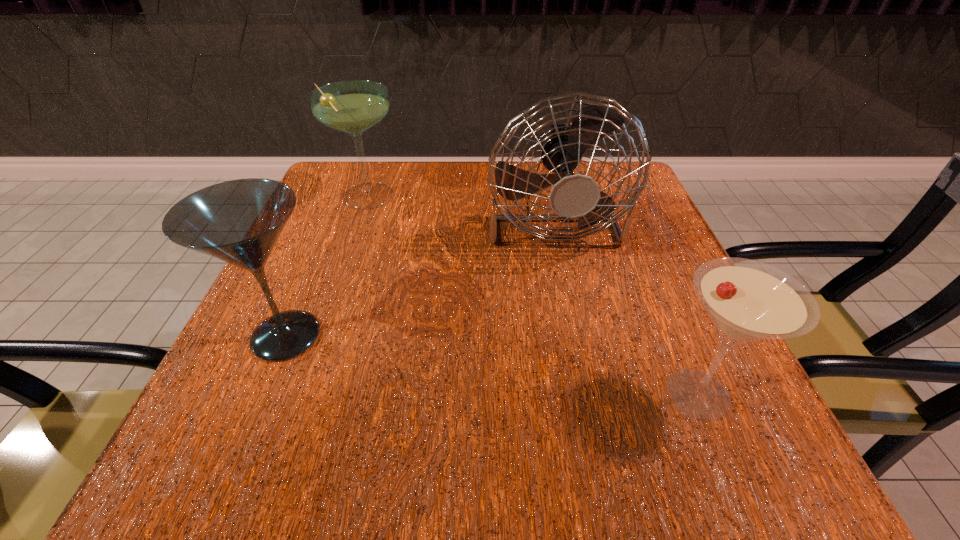
At what (x,y) coordinates should I click in order to perform the action: click on fan. Please return your answer as a coordinate pair (x, y). This screenshot has height=540, width=960. Looking at the image, I should click on (574, 197).

Locate an element on the screen. the farthest martini is located at coordinates (353, 106).

Locate an element on the screen. This screenshot has width=960, height=540. the shortest object is located at coordinates (x=747, y=300).

I want to click on the shortest martini, so click(747, 300).

Where is `vacant point located on the front-facing side of the tallest object`? The width and height of the screenshot is (960, 540). vacant point located on the front-facing side of the tallest object is located at coordinates (592, 416).

Locate an element on the screen. free space located 0.120m on the right of the farthest martini is located at coordinates (457, 198).

This screenshot has height=540, width=960. I want to click on vacant space located on the back of the shortest martini, so click(657, 295).

Where is `fan that is at the far edge`? This screenshot has width=960, height=540. fan that is at the far edge is located at coordinates (574, 197).

The height and width of the screenshot is (540, 960). I want to click on martini located in the far edge section of the desktop, so click(353, 106).

Locate an element on the screen. This screenshot has width=960, height=540. object that is at the near edge is located at coordinates (747, 300).